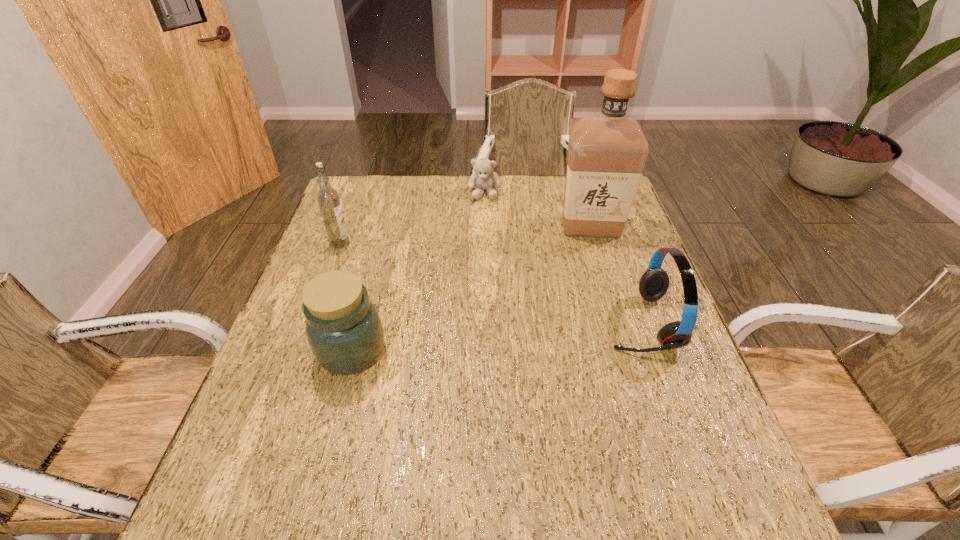
Locate an element on the screen. object that is the third closest to the teddy bear is located at coordinates (653, 284).

Select which object appears as the third closest to the jar. Please provide its 2D coordinates. Your answer should be formatted as a tuple, i.e. [(x, y)], where the tuple contains the x and y coordinates of a point satisfying the conditions above.

[(607, 152)]

This screenshot has height=540, width=960. Find the location of `free location that satisfies the following two spatial constraints: 1. on the front side of the jar; 2. on the left side of the leftmost object`. free location that satisfies the following two spatial constraints: 1. on the front side of the jar; 2. on the left side of the leftmost object is located at coordinates (300, 350).

Identify the location of free location that satisfies the following two spatial constraints: 1. on the back side of the tallest object; 2. on the right side of the fourth object from right to left. (384, 227).

What are the coordinates of `vacant region that satisfies the following two spatial constraints: 1. on the back side of the jar; 2. on the right side of the farthest object` in the screenshot? It's located at (394, 192).

Image resolution: width=960 pixels, height=540 pixels. Find the location of `vacant area in the image that satisfies the following two spatial constraints: 1. on the back side of the jar; 2. with the microphone attached to the side of the headset`. vacant area in the image that satisfies the following two spatial constraints: 1. on the back side of the jar; 2. with the microphone attached to the side of the headset is located at coordinates (359, 322).